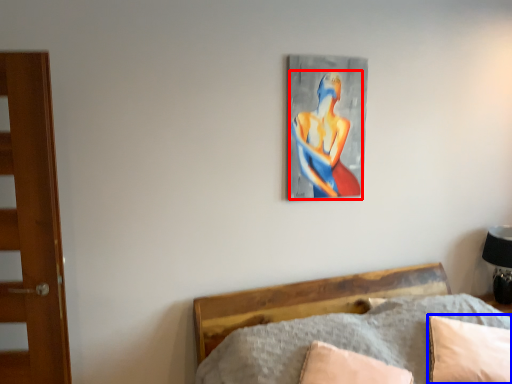
Question: Which point is further to the camera, person (highlighted by a red box) or pillow (highlighted by a blue box)?

Choices:
 (A) person
 (B) pillow

Answer: (A)